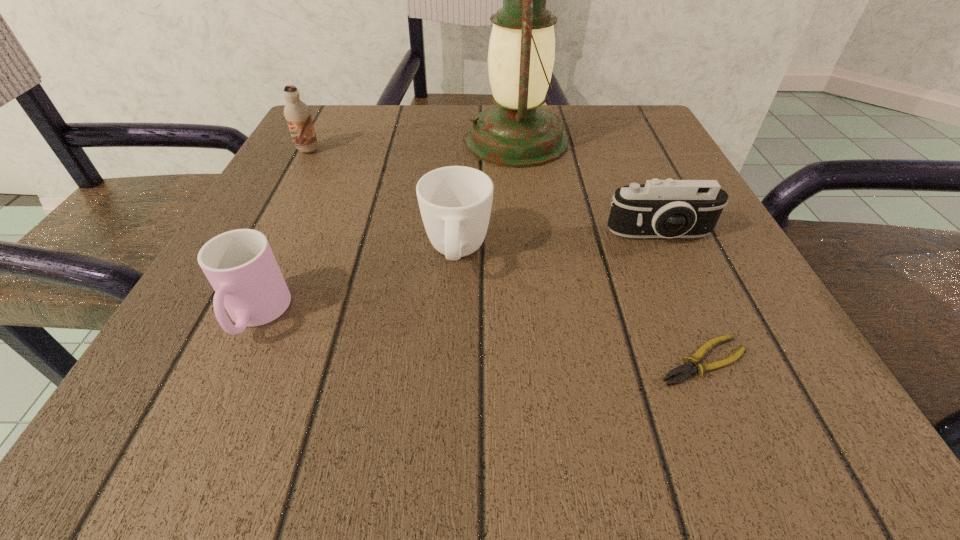
The width and height of the screenshot is (960, 540). In order to click on empty location between the left cup and the second tallest object in this screenshot , I will do `click(282, 233)`.

Image resolution: width=960 pixels, height=540 pixels. Identify the location of vacant space that's between the camera and the tallest object. (588, 188).

The height and width of the screenshot is (540, 960). In order to click on empty location between the chocolate milk and the lantern in this screenshot , I will do 412,145.

Identify the location of free space between the shortest object and the camera. The image size is (960, 540). (681, 298).

Where is `empty location between the pliers and the left cup`? This screenshot has width=960, height=540. empty location between the pliers and the left cup is located at coordinates (479, 339).

Find the location of a particular element. empty space between the chocolate milk and the left cup is located at coordinates (282, 233).

Where is `vacant space that is in between the left cup and the shortest object`? The width and height of the screenshot is (960, 540). vacant space that is in between the left cup and the shortest object is located at coordinates (479, 339).

Locate an element on the screen. The image size is (960, 540). vacant space that is in between the camera and the right cup is located at coordinates (559, 245).

You are a GUI agent. You are given a task and a screenshot of the screen. Output one action in this format:
    pyautogui.click(x=<x>, y=<y>)
    Task: Click on the object that stands as the closest to the left cup
    
    Given the screenshot: What is the action you would take?
    pyautogui.click(x=455, y=202)

Identify which object is the nearest to the pliers. Please provide its 2D coordinates. Your answer should be formatted as a tuple, i.e. [(x, y)], where the tuple contains the x and y coordinates of a point satisfying the conditions above.

[(669, 208)]